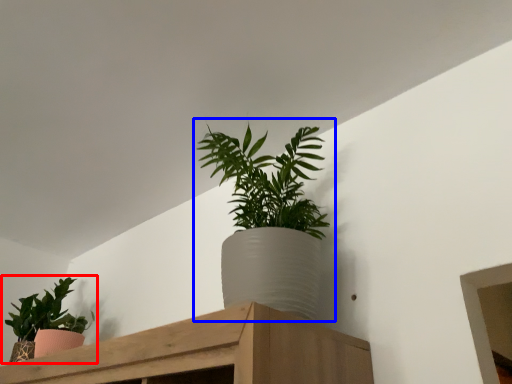
Question: Which object appears farthest to the camera in this image, houseplant (highlighted by a red box) or houseplant (highlighted by a blue box)?

Choices:
 (A) houseplant
 (B) houseplant

Answer: (A)